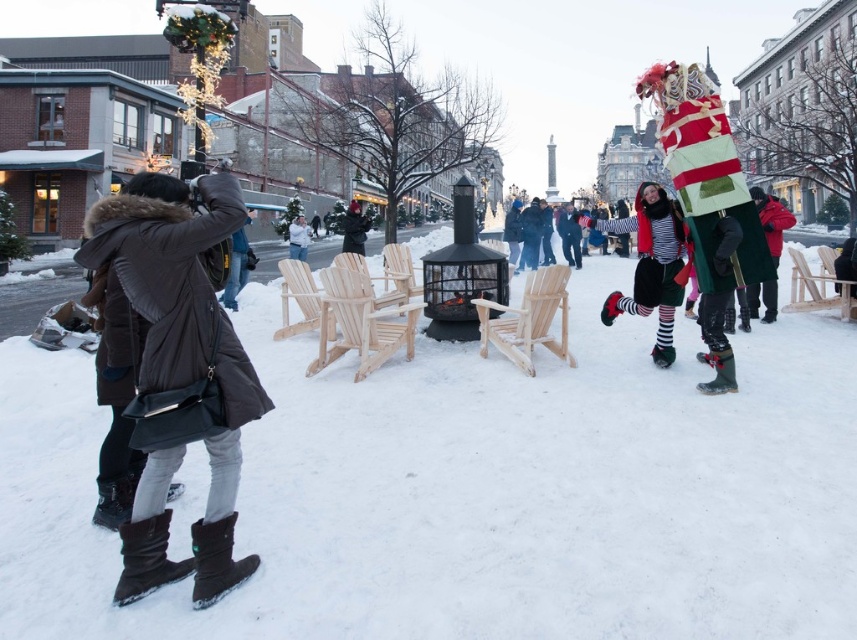
Does light brown wood chairs at center come behind dark brown leather jacket at center?

No, light brown wood chairs at center is in front of dark brown leather jacket at center.

Who is positioned more to the right, light brown wood chairs at center or dark brown leather jacket at center?

light brown wood chairs at center

Find the location of a particular element. This screenshot has width=857, height=640. light brown wood chairs at center is located at coordinates (360, 323).

This screenshot has height=640, width=857. I want to click on light brown wood chairs at center, so click(x=360, y=323).

Identify the location of shiny red fabric santa at right. The image size is (857, 640). (708, 202).

Is shiny red fabric santa at right above striped fabric costume at right?

Incorrect, shiny red fabric santa at right is not positioned above striped fabric costume at right.

Who is more distant from viewer, (732, 388) or (655, 264)?

Point (655, 264)

You are a GUI agent. You are given a task and a screenshot of the screen. Output one action in this format:
    pyautogui.click(x=<x>, y=<y>)
    Task: Click on the shiny red fabric santa at right
    
    Given the screenshot: What is the action you would take?
    pyautogui.click(x=708, y=202)

Which is above, red woolen sweater at right or light wood chair at center?

red woolen sweater at right is higher up.

Who is more distant from viewer, [784,212] or [315,307]?

Positioned behind is point [315,307].

Who is more distant from viewer, [766,300] or [285,275]?

Point [766,300]

In order to click on red woolen sweater at right in this screenshot , I will do `click(771, 220)`.